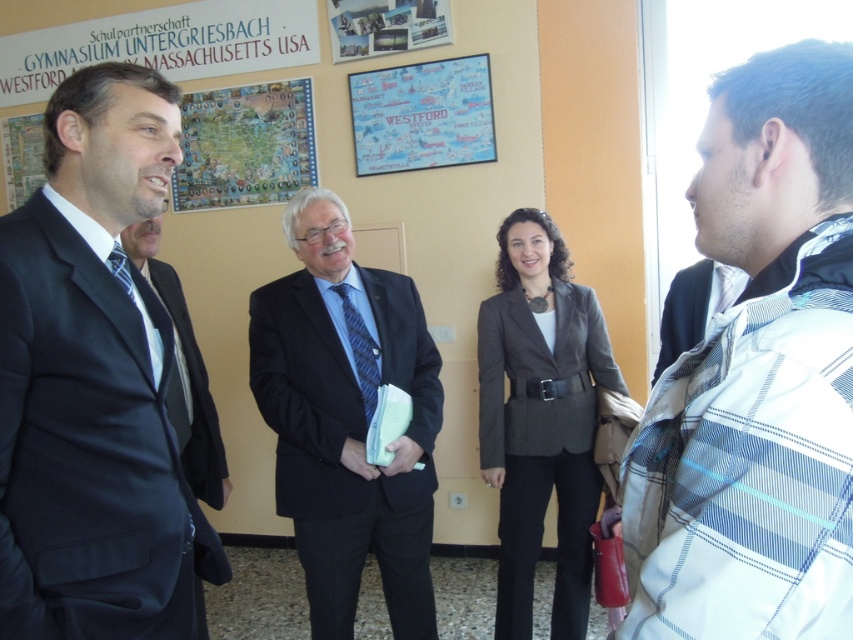
Is white plaid jacket at right wider than matte black suit at center?

Incorrect, white plaid jacket at right's width does not surpass matte black suit at center's.

Between point (717, 548) and point (302, 248), which one is positioned behind?

The point (302, 248) is behind.

You are a GUI agent. You are given a task and a screenshot of the screen. Output one action in this format:
    pyautogui.click(x=<x>, y=<y>)
    Task: Click on the white plaid jacket at right
    This screenshot has height=640, width=853.
    Given the screenshot: What is the action you would take?
    pyautogui.click(x=757, y=376)

Consider the image. Who is higher up, map paper at upper center or dark blue fabric business suit at right?

map paper at upper center is higher up.

The image size is (853, 640). What do you see at coordinates (245, 145) in the screenshot? I see `map paper at upper center` at bounding box center [245, 145].

What do you see at coordinates (245, 145) in the screenshot? I see `map paper at upper center` at bounding box center [245, 145].

Identify the location of map paper at upper center. (245, 145).

Does point (381, 538) lie behind point (418, 100)?

No, it is in front of (418, 100).

Can you confirm if matte black suit at center is positioned below matte paper map at upper center?

Yes.

Is point (350, 394) behind point (369, 134)?

That is False.

The height and width of the screenshot is (640, 853). I want to click on matte black suit at center, so click(347, 419).